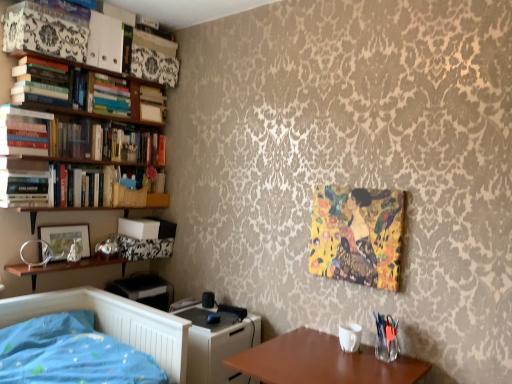
Find the location of `free point above wooden table at lower right (from a real-world perspective)`. free point above wooden table at lower right (from a real-world perspective) is located at coordinates (338, 358).